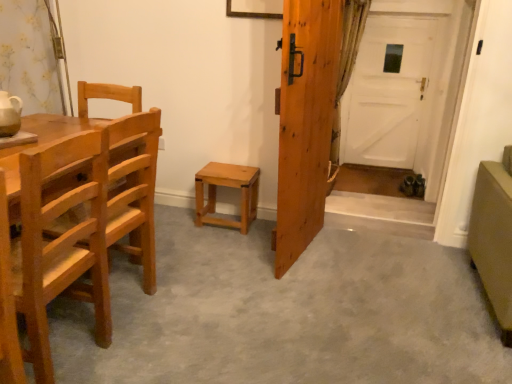
At what (x,y) coordinates should I click in order to perform the action: click on free point below light brown wood chair at left, the 2th chair viewed from the front (from a real-world perspective). Please return your answer as a coordinate pair (x, y). The width and height of the screenshot is (512, 384). Looking at the image, I should click on (125, 296).